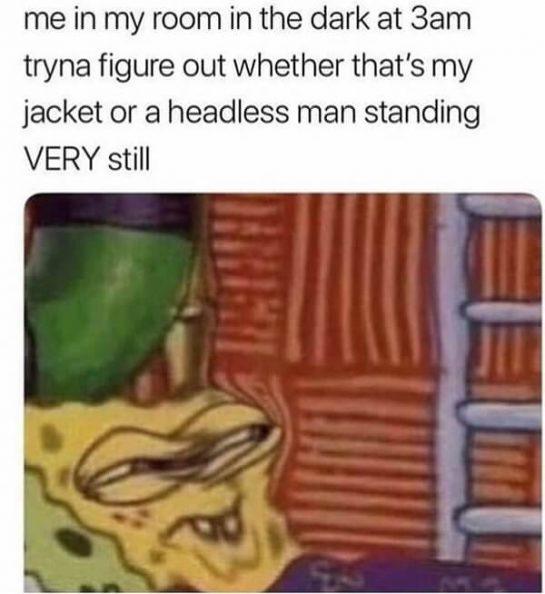
The width and height of the screenshot is (545, 594). What are the coordinates of `purple blanket` in the screenshot? It's located at (x=382, y=580).